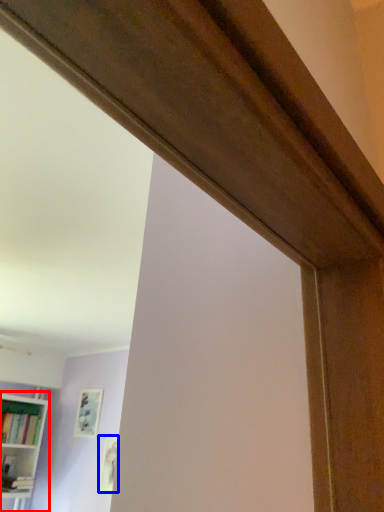
Question: Which object appears farthest to the camera in this image, bookcase (highlighted by a red box) or picture frame (highlighted by a blue box)?

Choices:
 (A) bookcase
 (B) picture frame

Answer: (B)